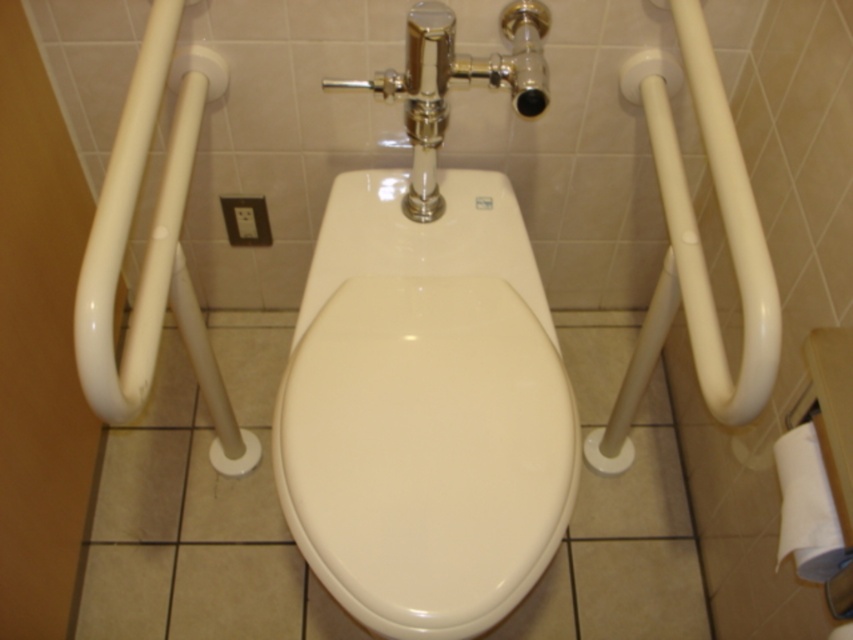
You are a caregiver assisting a patient who needs to reach the white paper towel at lower right. The patient is currently holding onto the white glossy grab bar at right. Can they reach the paper towel without letting go of the grab bar?

The white paper towel at lower right is behind the white glossy grab bar at right, so the patient cannot reach it while holding onto the grab bar.

You are a maintenance worker who needs to inspect the white glossy toilet at center. You are currently standing 36 inches away from it. Can you reach the toilet without moving closer?

The white glossy toilet at center and camera are 33.10 inches apart. Since you are standing 36 inches away, you are slightly farther than the distance to the camera. Therefore, you need to move 2.9 inches closer to reach it.

You are standing in the bathroom and need to reach a point behind you. Which of the two points, point (294, 483) or point (759, 353), is located behind you?

Point (294, 483) is behind point (759, 353).